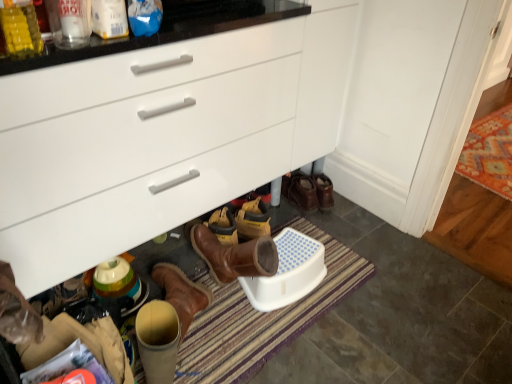
Question: Considering the relative positions of striped fabric bath mat at lower center and white glossy cabinet at center in the image provided, is striped fabric bath mat at lower center in front of white glossy cabinet at center?

Choices:
 (A) yes
 (B) no

Answer: (B)

Question: Is striped fabric bath mat at lower center at the left side of white glossy cabinet at center?

Choices:
 (A) no
 (B) yes

Answer: (A)

Question: From a real-world perspective, is striped fabric bath mat at lower center physically above white glossy cabinet at center?

Choices:
 (A) no
 (B) yes

Answer: (A)

Question: From a real-world perspective, is striped fabric bath mat at lower center beneath white glossy cabinet at center?

Choices:
 (A) yes
 (B) no

Answer: (A)

Question: Is striped fabric bath mat at lower center positioned with its back to white glossy cabinet at center?

Choices:
 (A) yes
 (B) no

Answer: (A)

Question: From the image's perspective, is striped fabric bath mat at lower center above white glossy cabinet at center?

Choices:
 (A) no
 (B) yes

Answer: (A)

Question: Does striped fabric bath mat at lower center have a smaller size compared to leather handbag at lower left?

Choices:
 (A) no
 (B) yes

Answer: (A)

Question: Is striped fabric bath mat at lower center shorter than leather handbag at lower left?

Choices:
 (A) no
 (B) yes

Answer: (B)

Question: From the image's perspective, is striped fabric bath mat at lower center beneath leather handbag at lower left?

Choices:
 (A) yes
 (B) no

Answer: (B)

Question: Can you confirm if striped fabric bath mat at lower center is positioned to the left of leather handbag at lower left?

Choices:
 (A) no
 (B) yes

Answer: (A)

Question: Does striped fabric bath mat at lower center lie in front of leather handbag at lower left?

Choices:
 (A) yes
 (B) no

Answer: (B)

Question: From the image's perspective, is striped fabric bath mat at lower center on top of leather handbag at lower left?

Choices:
 (A) no
 (B) yes

Answer: (B)

Question: Is white glossy cabinet at center located outside white plastic phone at lower center?

Choices:
 (A) yes
 (B) no

Answer: (A)